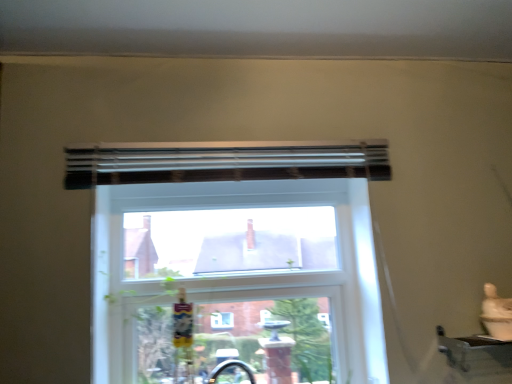
The image size is (512, 384). I want to click on free location above black matte curtain at upper center (from a real-world perspective), so pos(227,138).